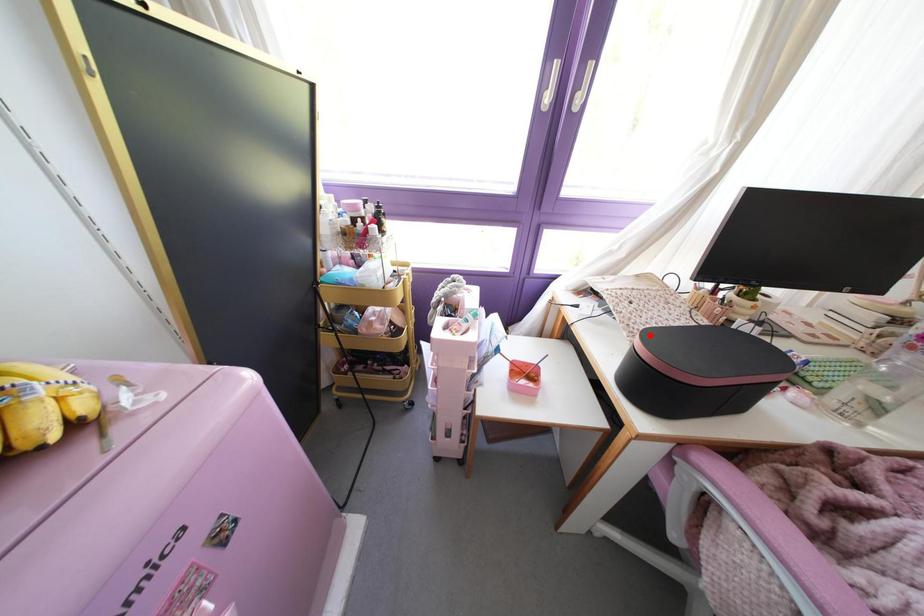
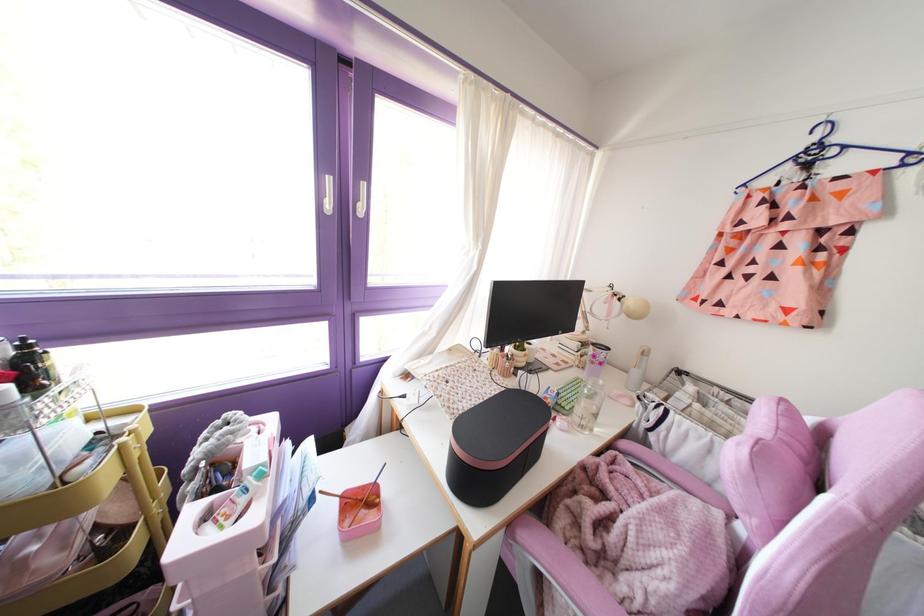
In the second image, find the point that corresponds to the highlighted location in the first image.

(459, 426)